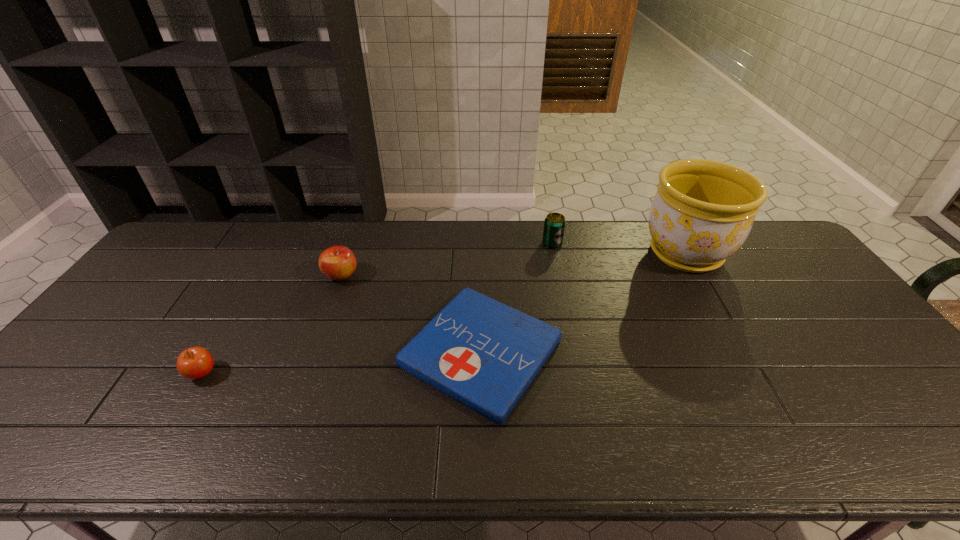
Identify the location of the closest object to the right apple. (484, 354).

Identify the location of free spot that satisfies the following two spatial constraints: 1. on the back side of the leftmost object; 2. on the left side of the first-aid kit. (214, 352).

This screenshot has height=540, width=960. Identify the location of vacant space that satisfies the following two spatial constraints: 1. on the back side of the nearer apple; 2. on the right side of the second object from left to right. (258, 275).

Where is `free space that satisfies the following two spatial constraints: 1. on the back side of the beer can; 2. on the right side of the first-aid kit`? The image size is (960, 540). free space that satisfies the following two spatial constraints: 1. on the back side of the beer can; 2. on the right side of the first-aid kit is located at coordinates (481, 244).